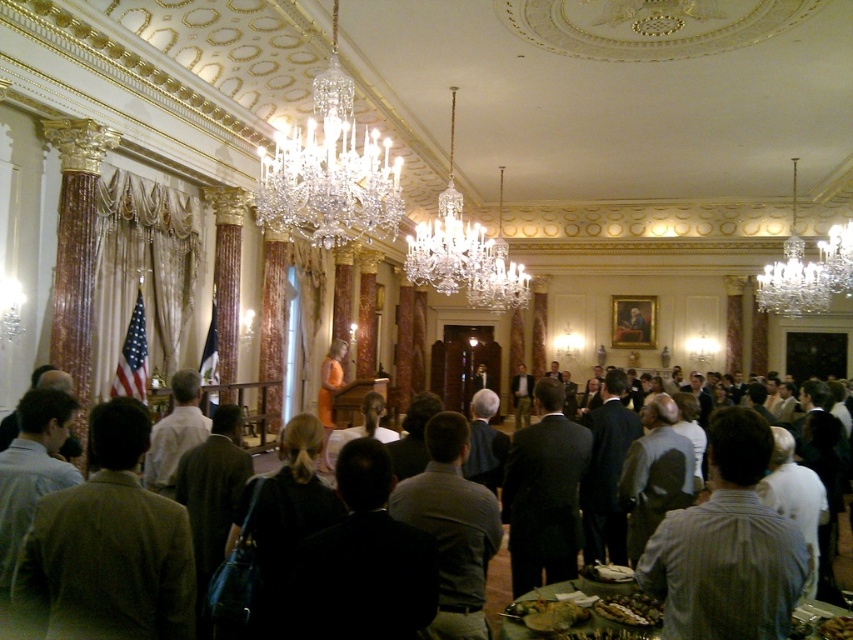
Question: Is the position of dark brown suit at center more distant than that of shiny brown nuts at lower center?

Choices:
 (A) yes
 (B) no

Answer: (B)

Question: Does dark brown suit at center have a lesser width compared to shiny brown nuts at lower center?

Choices:
 (A) no
 (B) yes

Answer: (A)

Question: Which point is farther to the camera?

Choices:
 (A) dark brown suit at center
 (B) shiny brown nuts at lower center

Answer: (B)

Question: Which point appears farthest from the camera in this image?

Choices:
 (A) (659, 608)
 (B) (488, 609)

Answer: (B)

Question: Can you confirm if dark brown suit at center is smaller than shiny brown nuts at lower center?

Choices:
 (A) no
 (B) yes

Answer: (A)